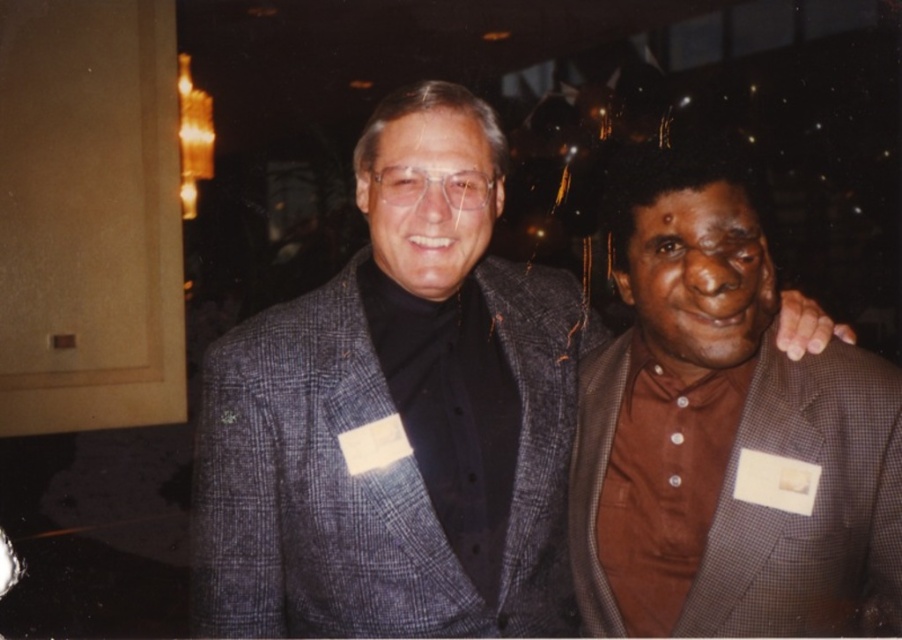
You are standing in the same room as the plaid wool blazer at center. If you want to touch the blazer, how many steps do you need to take if each step covers 1.2 feet?

The plaid wool blazer at center is 3.83 feet away from you. Since each step covers 1.2 feet, you would need to take approximately 3 steps to reach it. This is calculated by dividing 3.83 by 1.2, which equals roughly 3.19 steps. Since you can only take whole steps, rounding up gives 3 steps.

You are at a formal event and want to move from your current position to the exit located at point (247, 554). There is an obstacle at point (682, 369). Can you safely reach the exit without passing through the obstacle?

Point (247, 554) is in front of point (682, 369), so you can safely reach the exit at point (247, 554) without passing through the obstacle at point (682, 369).